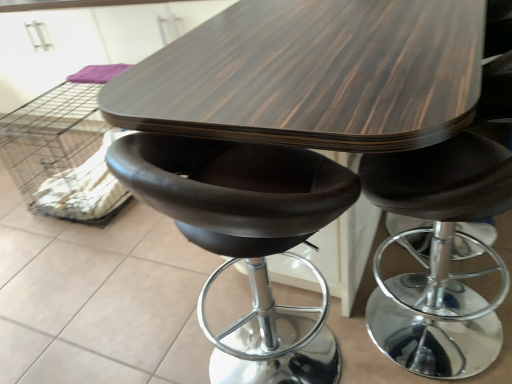
Question: From the image's perspective, is dark wood table at center located beneath white fabric crate at lower left?

Choices:
 (A) no
 (B) yes

Answer: (B)

Question: Is dark wood table at center behind white fabric crate at lower left?

Choices:
 (A) yes
 (B) no

Answer: (B)

Question: Does dark wood table at center have a larger size compared to white fabric crate at lower left?

Choices:
 (A) yes
 (B) no

Answer: (A)

Question: Is dark wood table at center next to white fabric crate at lower left?

Choices:
 (A) no
 (B) yes

Answer: (A)

Question: From a real-world perspective, is dark wood table at center positioned over white fabric crate at lower left based on gravity?

Choices:
 (A) yes
 (B) no

Answer: (A)

Question: Considering the relative positions of dark wood table at center and white fabric crate at lower left in the image provided, is dark wood table at center to the left of white fabric crate at lower left from the viewer's perspective?

Choices:
 (A) yes
 (B) no

Answer: (B)

Question: Can you confirm if matte black stool at center is positioned to the right of white fabric crate at lower left?

Choices:
 (A) no
 (B) yes

Answer: (B)

Question: Considering the relative sizes of matte black stool at center and white fabric crate at lower left in the image provided, is matte black stool at center taller than white fabric crate at lower left?

Choices:
 (A) yes
 (B) no

Answer: (A)

Question: From a real-world perspective, is matte black stool at center positioned over white fabric crate at lower left based on gravity?

Choices:
 (A) no
 (B) yes

Answer: (B)

Question: Can you see matte black stool at center touching white fabric crate at lower left?

Choices:
 (A) no
 (B) yes

Answer: (A)

Question: Would you say matte black stool at center is outside white fabric crate at lower left?

Choices:
 (A) yes
 (B) no

Answer: (A)

Question: Considering the relative positions of matte black stool at center and white fabric crate at lower left in the image provided, is matte black stool at center to the left of white fabric crate at lower left from the viewer's perspective?

Choices:
 (A) yes
 (B) no

Answer: (B)

Question: From a real-world perspective, is dark wood table at center on matte black stool at center?

Choices:
 (A) yes
 (B) no

Answer: (B)